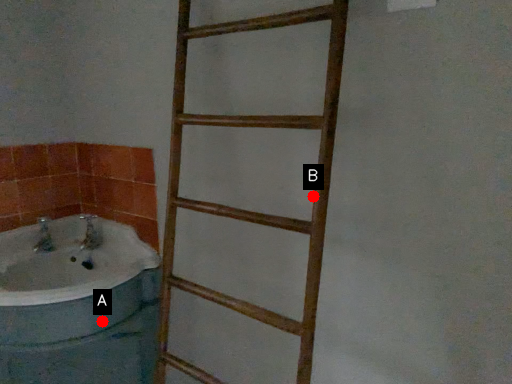
Question: Two points are circled on the image, labeled by A and B beside each circle. Among these points, which one is farthest from the camera?

Choices:
 (A) A is further
 (B) B is further

Answer: (A)